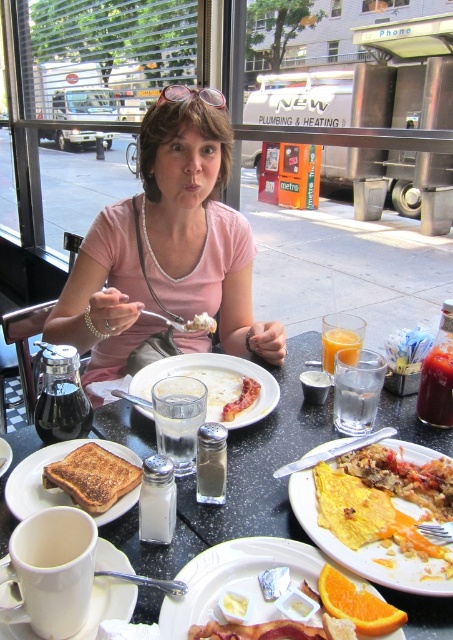
Looking at this image, you are a waiter at a restaurant and you need to deliver a dessert to the table. The dessert should be placed on the white matte plate at center. According to the coordinates provided, where should you place the dessert?

The dessert should be placed at the coordinates point [215,384] where the white matte plate at center is located.

You are a waiter in a restaurant and need to clear the table. The customer has finished eating. Which item should you pick up first, the matte white plate with food at lower center or the translucent glass cup at center?

The matte white plate with food at lower center is on the left side of the translucent glass cup at center, so you should pick up the plate first as it is closer to the edge of the table.

You are a food critic evaluating the presentation of this breakfast plate. Which item is wider, the yellow omelette at center or the toasted bread at lower left?

The yellow omelette at center is wider than the toasted bread at lower left according to the description provided.